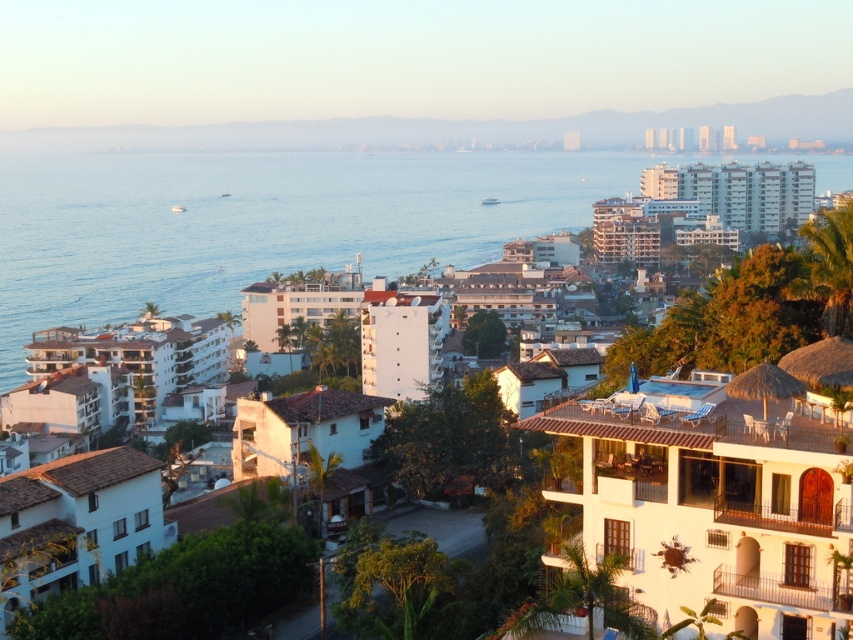
Who is lower down, blue water at center or white stucco buildings at upper center?

blue water at center

Which of these two, blue water at center or white stucco buildings at upper center, stands taller?

With more height is blue water at center.

Between point (171, 260) and point (16, 154), which one is positioned in front?

Point (171, 260)

Image resolution: width=853 pixels, height=640 pixels. What are the coordinates of `blue water at center` in the screenshot? It's located at (263, 224).